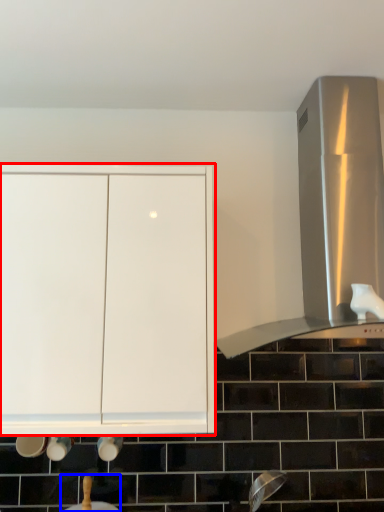
Question: Which point is further to the camera, cabinetry (highlighted by a red box) or sink (highlighted by a blue box)?

Choices:
 (A) cabinetry
 (B) sink

Answer: (B)